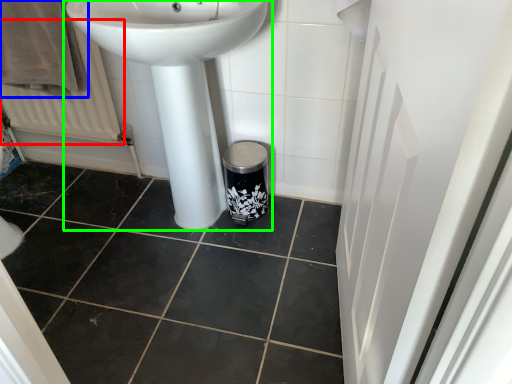
Question: Which object is the closest to the radiator (highlighted by a red box)? Choose among these: bath towel (highlighted by a blue box) or sink (highlighted by a green box).

Choices:
 (A) bath towel
 (B) sink

Answer: (A)